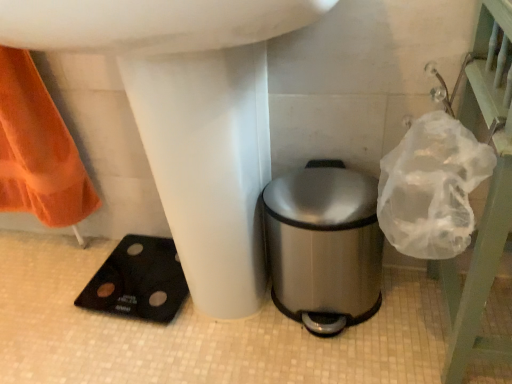
Question: Looking at their shapes, would you say clear plastic bag at upper right is wider or thinner than white glossy sink at center?

Choices:
 (A) thin
 (B) wide

Answer: (A)

Question: Based on their sizes in the image, would you say clear plastic bag at upper right is bigger or smaller than white glossy sink at center?

Choices:
 (A) small
 (B) big

Answer: (A)

Question: Considering the real-world distances, which object is farthest from the stainless steel trash can at lower right?

Choices:
 (A) white glossy sink at center
 (B) clear plastic bag at upper right

Answer: (B)

Question: Which is nearer to the stainless steel trash can at lower right?

Choices:
 (A) clear plastic bag at upper right
 (B) white glossy sink at center

Answer: (B)